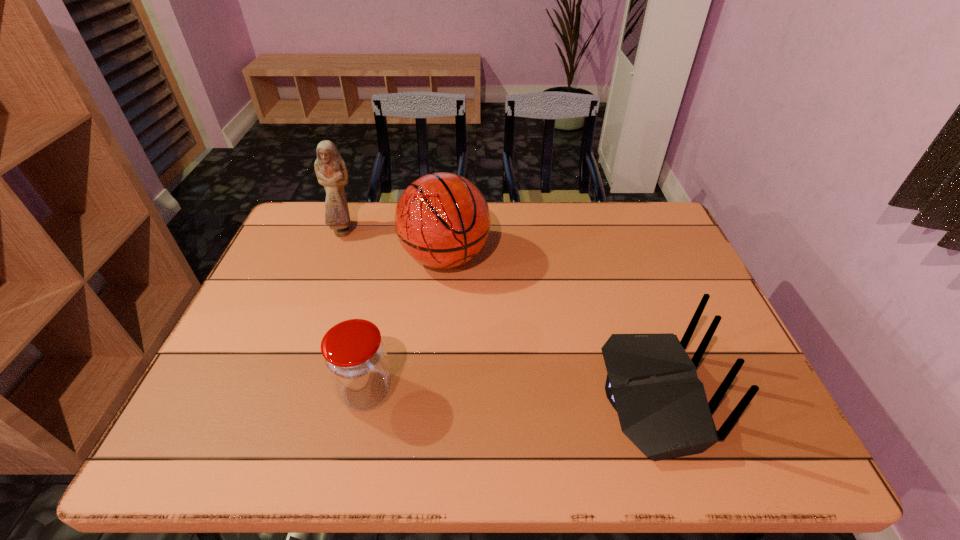
You are a GUI agent. You are given a task and a screenshot of the screen. Output one action in this format:
    pyautogui.click(x=<x>, y=<y>)
    Task: Click on the free space that is in between the figurine and the jar
    
    Given the screenshot: What is the action you would take?
    pyautogui.click(x=355, y=311)

Where is `vacant space in between the router and the jar`? vacant space in between the router and the jar is located at coordinates (509, 394).

Identify the location of vacant point located between the router and the leftmost object. The height and width of the screenshot is (540, 960). click(497, 314).

Where is `vacant space that is in between the jar and the basketball`? vacant space that is in between the jar and the basketball is located at coordinates (406, 325).

Where is `object that ranks as the closest to the rightmost object`? The width and height of the screenshot is (960, 540). object that ranks as the closest to the rightmost object is located at coordinates (442, 220).

Locate which object ranks in proximity to the router. Please provide its 2D coordinates. Your answer should be formatted as a tuple, i.e. [(x, y)], where the tuple contains the x and y coordinates of a point satisfying the conditions above.

[(442, 220)]

Locate an element on the screen. The image size is (960, 540). free region that satisfies the following two spatial constraints: 1. on the front side of the router; 2. on the back of the jar is located at coordinates (365, 396).